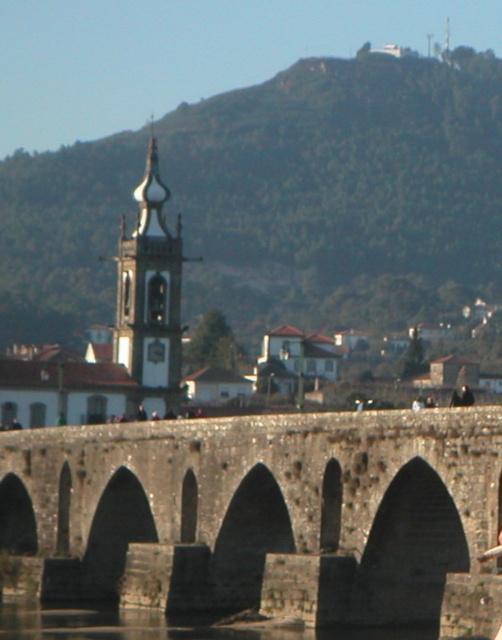
Question: Among these points, which one is nearest to the camera?

Choices:
 (A) (325, 456)
 (B) (94, 627)

Answer: (A)

Question: Which point appears farthest from the camera in this image?

Choices:
 (A) (96, 628)
 (B) (258, 449)

Answer: (B)

Question: Can you confirm if stone arch bridge at center is positioned to the left of clear water at bridge center?

Choices:
 (A) no
 (B) yes

Answer: (A)

Question: Is stone arch bridge at center above clear water at bridge center?

Choices:
 (A) no
 (B) yes

Answer: (B)

Question: Which object is closer to the camera taking this photo?

Choices:
 (A) stone arch bridge at center
 (B) clear water at bridge center

Answer: (A)

Question: In this image, where is stone arch bridge at center located relative to clear water at bridge center?

Choices:
 (A) below
 (B) above

Answer: (B)